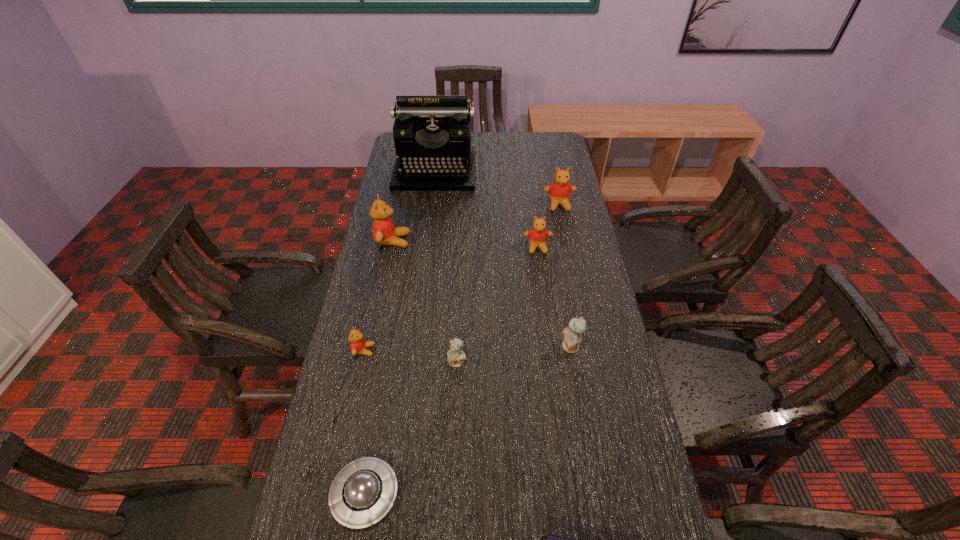
I want to click on free space located 0.360m on the front-facing side of the fourth teddy bear from right to left, so coord(451,515).

This screenshot has width=960, height=540. Identify the location of vacant space located on the front-facing side of the smallest red teddy bear. (425, 350).

What are the coordinates of `free region located 0.320m on the back of the saucer` in the screenshot? It's located at pos(391,346).

Where is `object that is at the far edge`? The height and width of the screenshot is (540, 960). object that is at the far edge is located at coordinates (432, 134).

This screenshot has width=960, height=540. I want to click on typewriter that is at the left edge, so click(x=432, y=134).

I want to click on saucer that is at the left edge, so click(362, 493).

Locate an element on the screen. object that is positioned at the far left corner is located at coordinates (432, 134).

At what (x,y) coordinates should I click in order to perform the action: click on free space at the far edge of the desktop. Please return your answer as a coordinate pair (x, y). The width and height of the screenshot is (960, 540). Looking at the image, I should click on (496, 151).

The height and width of the screenshot is (540, 960). Identify the location of free space at the left edge of the desktop. (388, 171).

Locate an element on the screen. The height and width of the screenshot is (540, 960). free point at the right edge is located at coordinates (553, 167).